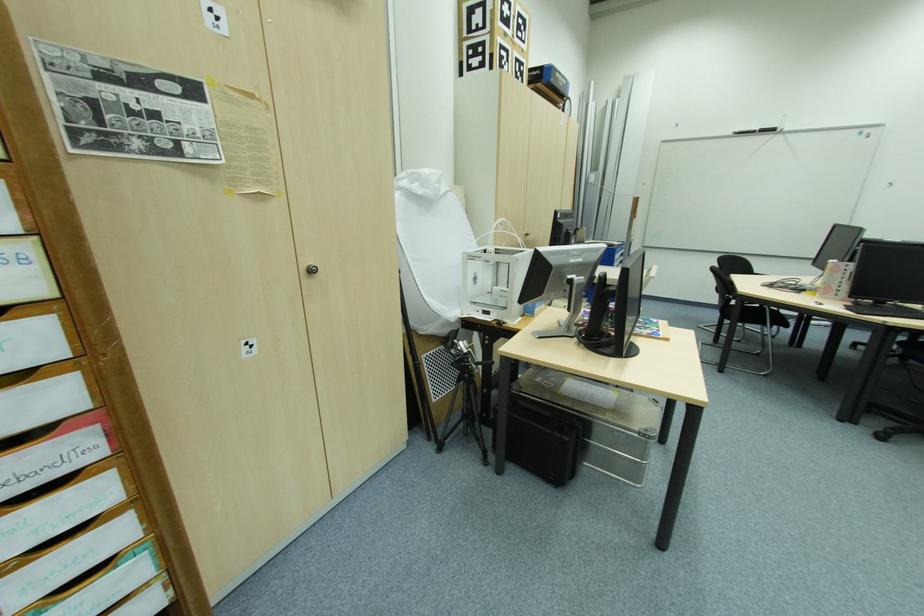
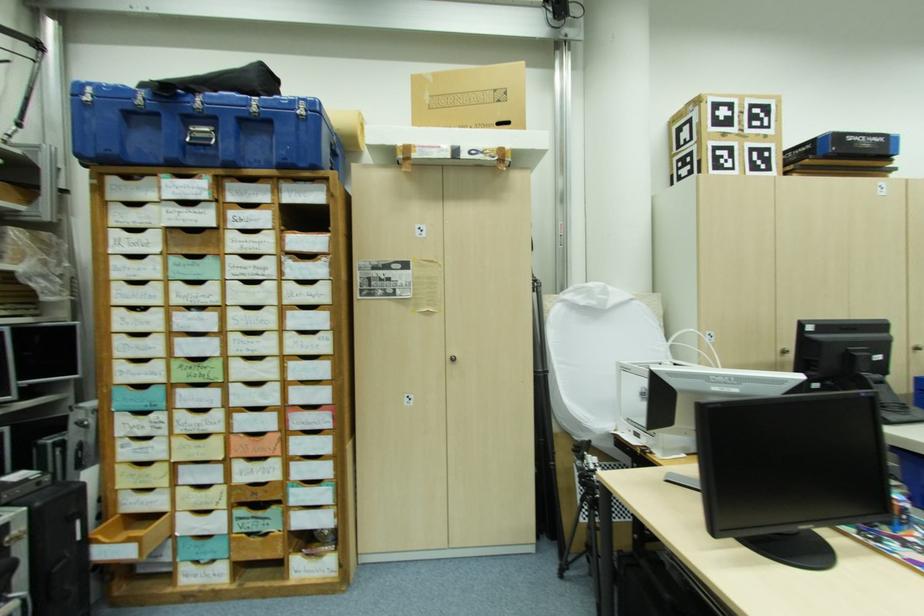
Question: The camera is either moving clockwise (left) or counter-clockwise (right) around the object. The first image is from the beginning of the video and the second image is from the end. Is the camera moving left or right when shooting the video?

Choices:
 (A) Left
 (B) Right

Answer: (B)